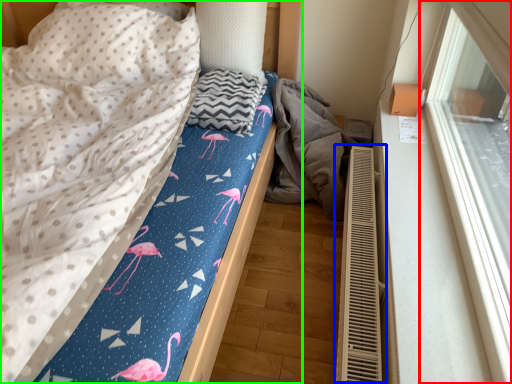
Question: Estimate the real-world distances between objects in this image. Which object is farther from window (highlighted by a red box), air conditioner (highlighted by a blue box) or bed (highlighted by a green box)?

Choices:
 (A) air conditioner
 (B) bed

Answer: (B)